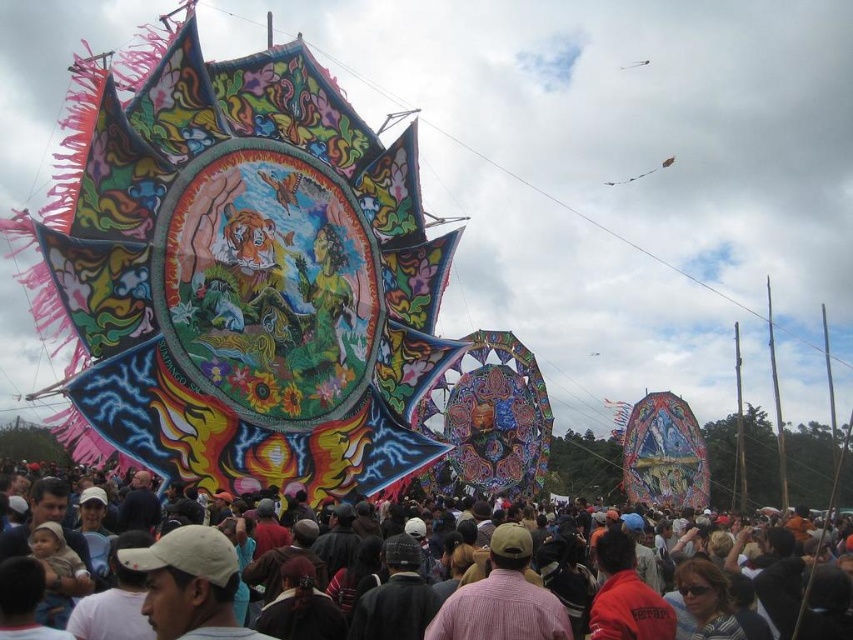
You are at the festival and want to take a photo of the transparent plastic kite at upper center without any people blocking it. Is the matte black crowd at center in the way?

The matte black crowd at center is below the transparent plastic kite at upper center, so the kite is above the crowd and should be visible without obstruction.

You are at the festival and want to take a photo of both the pink woven shirt at center and the transparent plastic kite at upper center. Which object should you focus on first to ensure both are in frame?

The pink woven shirt at center is taller than the transparent plastic kite at upper center, so focus on the pink woven shirt at center first to ensure both fit within the frame.

You are standing in the middle of the festival crowd and see two points in the scene. The first point is at coordinate point (506,595) and the second is at coordinate point (637,61). Which point is closer to you?

Point (506,595) is closer to the viewer than point (637,61).